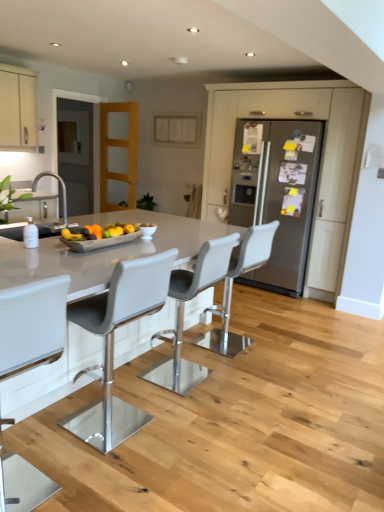
Image resolution: width=384 pixels, height=512 pixels. What are the coordinates of `vacant area located to the right-hand side of white leather bar stool at center, placed as the third chair when sorted from back to front` in the screenshot? It's located at (187, 433).